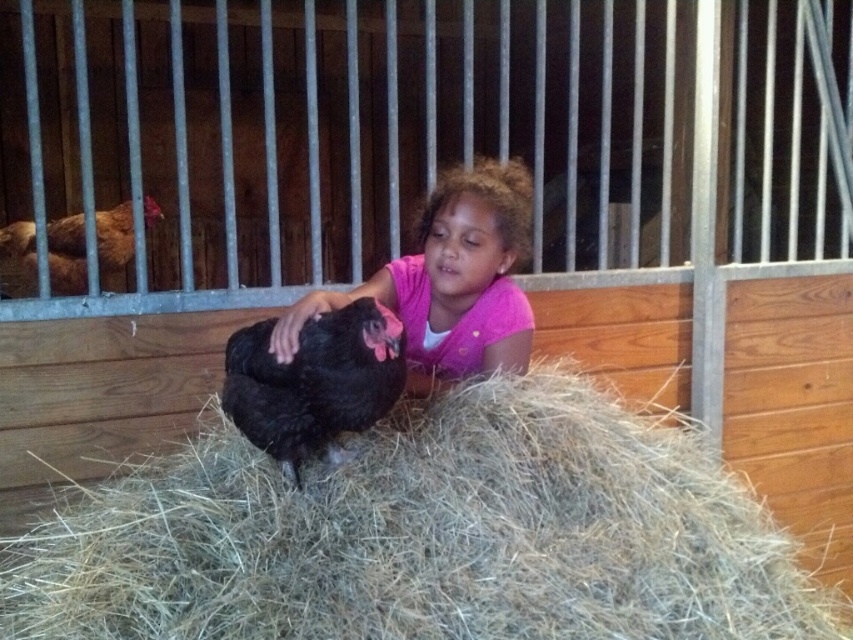
Question: Does light brown straw at center have a lesser width compared to black feathered chicken at center?

Choices:
 (A) no
 (B) yes

Answer: (A)

Question: Does light brown straw at center lie in front of pink matte shirt at center?

Choices:
 (A) no
 (B) yes

Answer: (B)

Question: Which of the following is the closest to the observer?

Choices:
 (A) light brown straw at center
 (B) pink matte shirt at center

Answer: (A)

Question: Among these points, which one is farthest from the camera?

Choices:
 (A) pyautogui.click(x=106, y=253)
 (B) pyautogui.click(x=425, y=204)
 (C) pyautogui.click(x=344, y=378)
 (D) pyautogui.click(x=828, y=616)

Answer: (A)

Question: Is black feathered chicken at center to the right of brown feathered chicken at left from the viewer's perspective?

Choices:
 (A) no
 (B) yes

Answer: (B)

Question: Which object is the closest to the black feathered chicken at center?

Choices:
 (A) light brown straw at center
 (B) pink matte shirt at center
 (C) brown feathered chicken at left

Answer: (B)